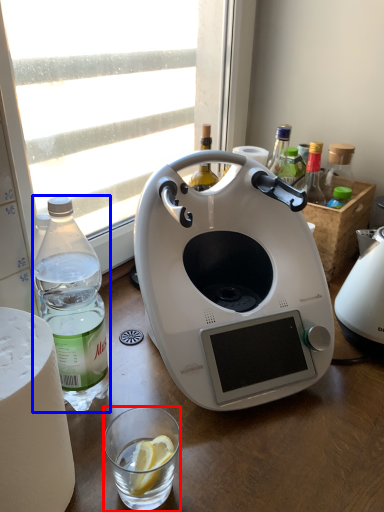
Question: Which object is further to the camera taking this photo, coffee cup (highlighted by a red box) or bottle (highlighted by a blue box)?

Choices:
 (A) coffee cup
 (B) bottle

Answer: (A)